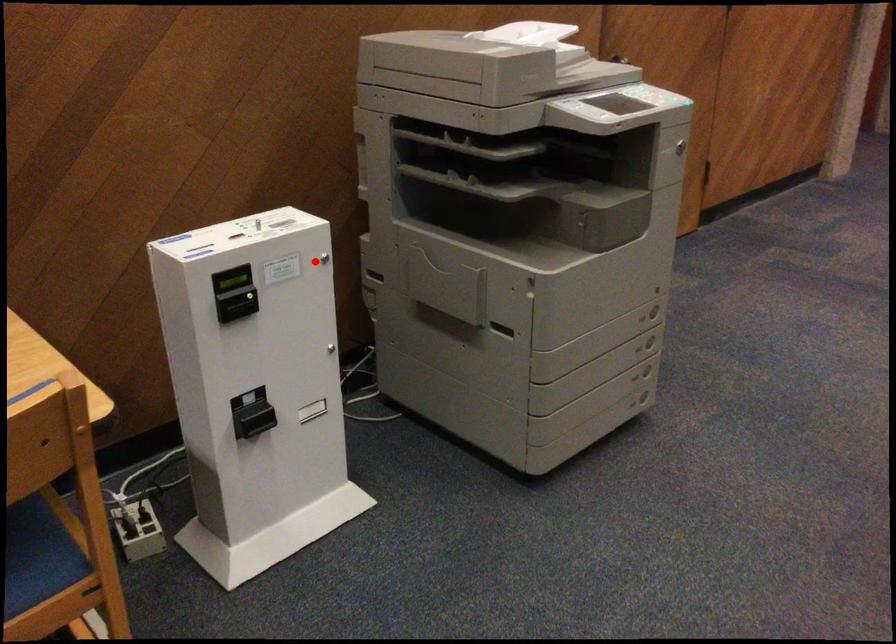
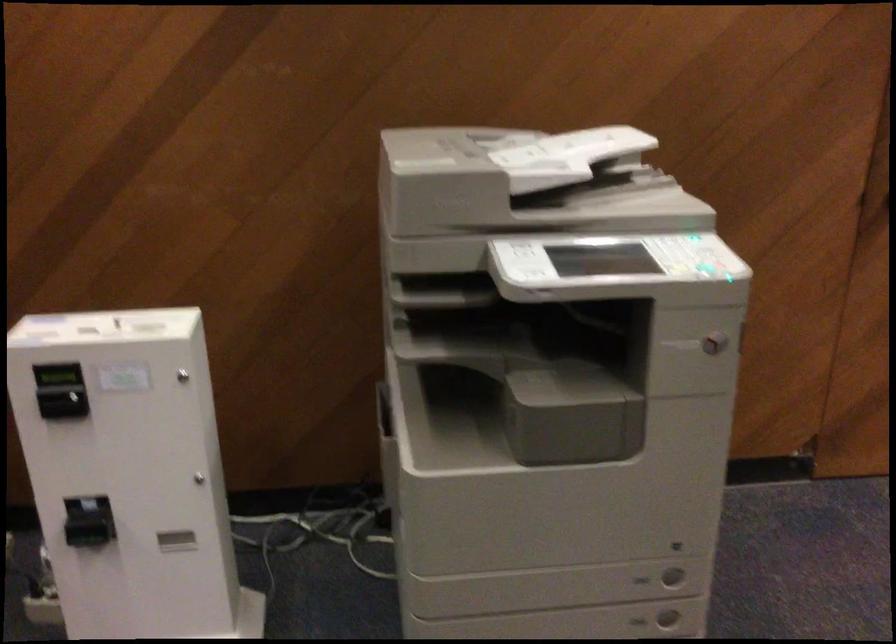
The point at the highlighted location is marked in the first image. Where is the corresponding point in the second image?

(183, 375)